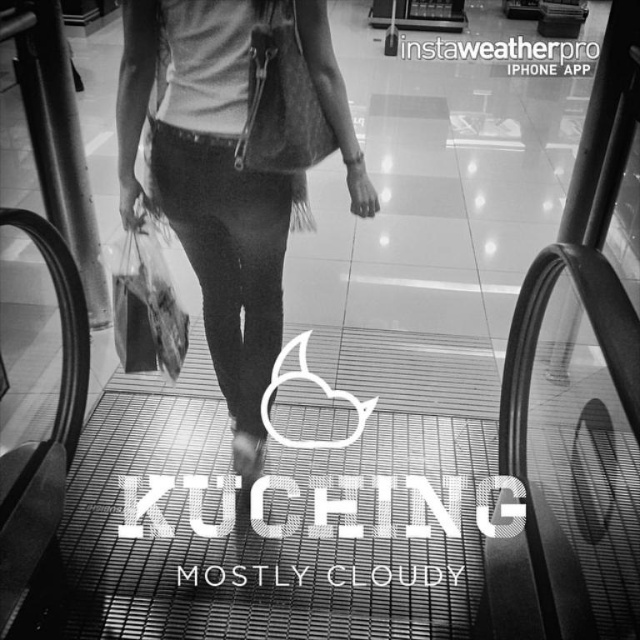
You are standing on the escalator and see both the suede bag at center and the translucent plastic bag at center. Which one is positioned to the right?

The suede bag at center is positioned to the right of the translucent plastic bag at center.

You are an observer standing at the bottom of the escalator. You see a person carrying two bags at the center of the escalator. Which bag, the suede bag at center or the translucent plastic bag at center, is bigger?

The suede bag at center is larger in size than the translucent plastic bag at center, so the suede bag at center is bigger.

You are standing on the escalator and see the suede bag at center. Where is the suede bag located relative to the point marked at coordinates (211, 188)?

The point marked at coordinates (211, 188) indicates the location of the suede bag at center, so they are at the same position.